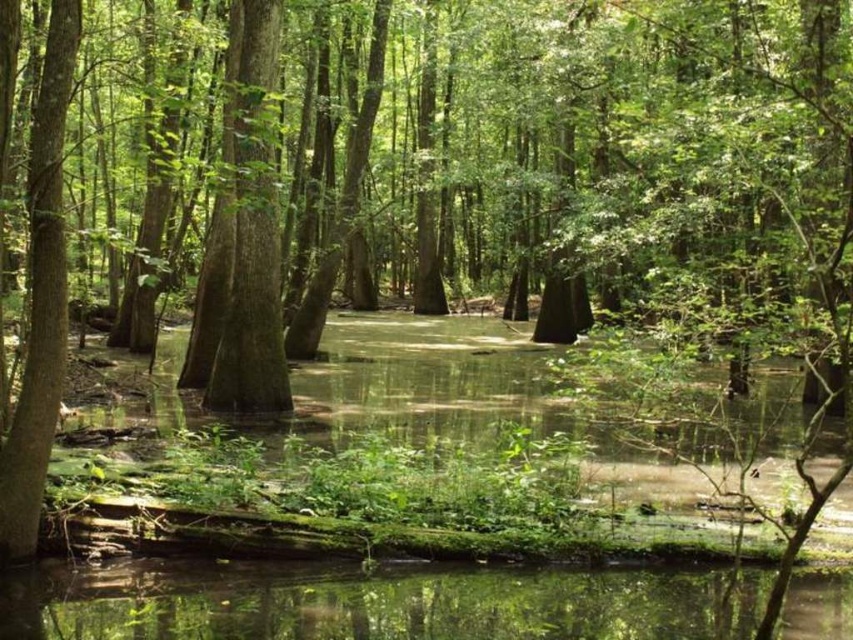
Which is above, green reflective water at center or green rough bark tree at center?

green rough bark tree at center

Can you confirm if green reflective water at center is positioned below green rough bark tree at center?

Indeed, green reflective water at center is positioned under green rough bark tree at center.

Is point (509, 634) behind point (234, 198)?

No, it is not.

Locate an element on the screen. This screenshot has width=853, height=640. green reflective water at center is located at coordinates (376, 604).